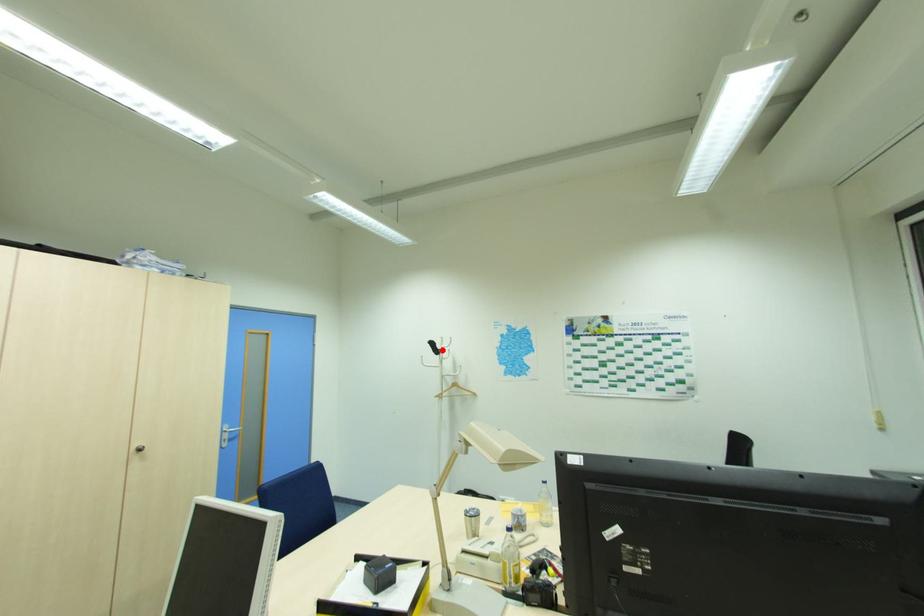
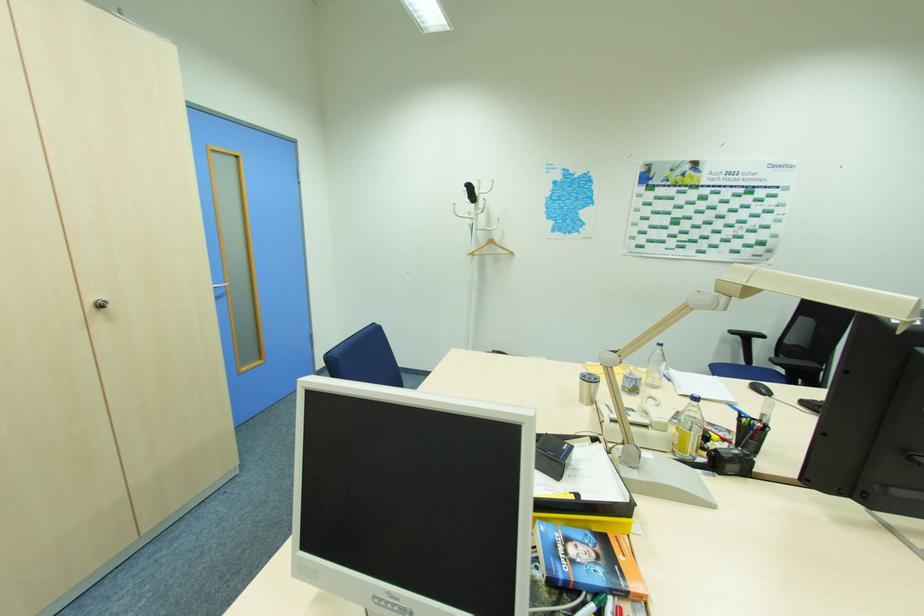
In the second image, find the point that corresponds to the highlighted location in the first image.

(479, 197)